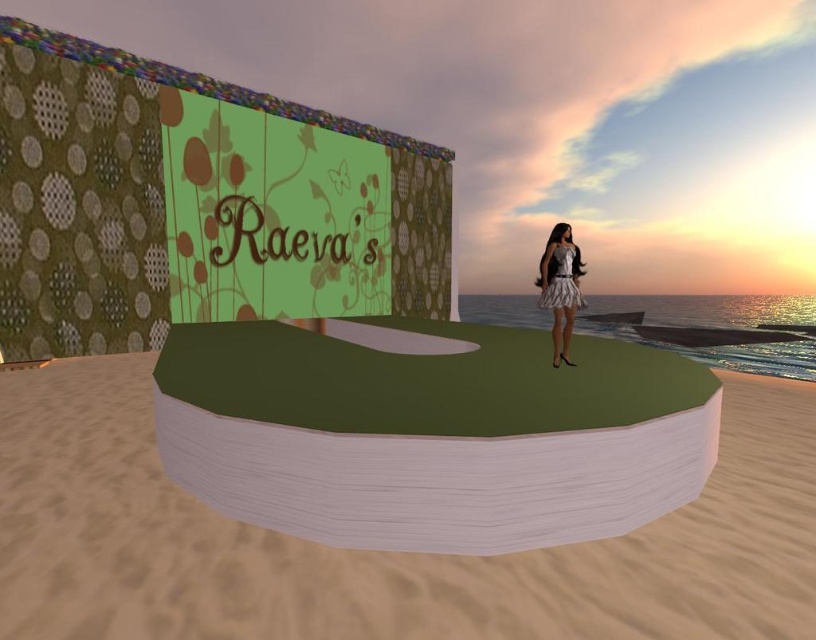
Question: Is green wood golf course at center smaller than white satin dress at center?

Choices:
 (A) no
 (B) yes

Answer: (B)

Question: Does green wood golf course at center appear under white satin dress at center?

Choices:
 (A) yes
 (B) no

Answer: (A)

Question: Which of the following is the closest to the observer?

Choices:
 (A) (185, 419)
 (B) (559, 330)
 (C) (725, 541)

Answer: (C)

Question: Which point is farther to the camera?

Choices:
 (A) green matte sand at center
 (B) green wood golf course at center
 (C) white satin dress at center

Answer: (C)

Question: Which object is farther from the camera taking this photo?

Choices:
 (A) white satin dress at center
 (B) green matte sand at center

Answer: (A)

Question: Is green wood golf course at center behind white satin dress at center?

Choices:
 (A) yes
 (B) no

Answer: (B)